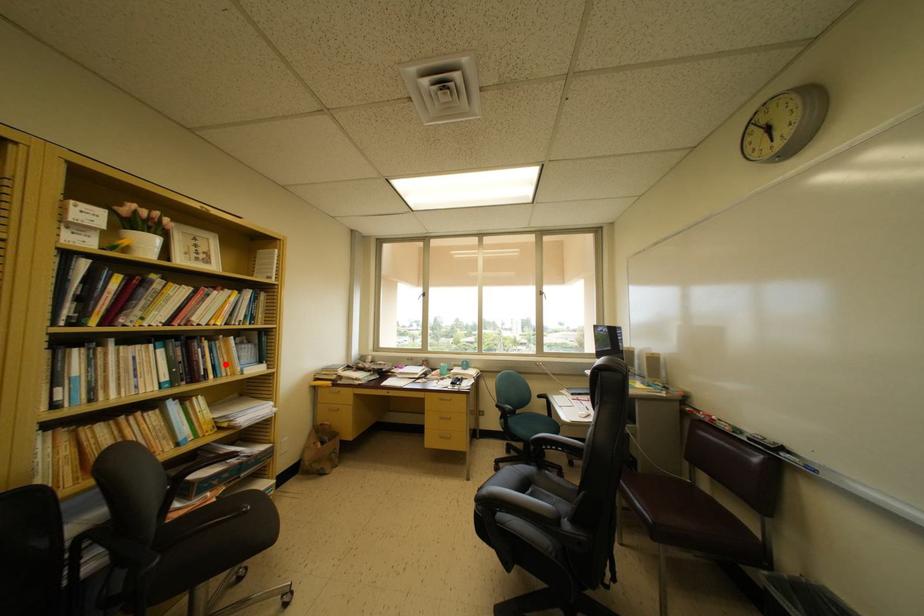
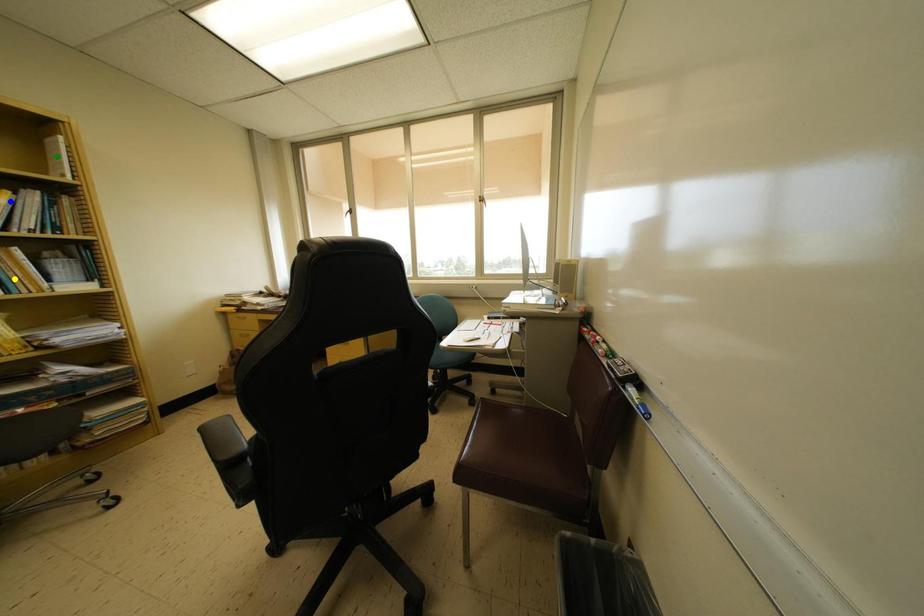
Question: I am providing you with two images of the same scene from different viewpoints. A red point is marked on the first image. You are given multiple points on the second image. Which point in image 2 represents the same 3d spot as the red point in image 1?

Choices:
 (A) yellow point
 (B) green point
 (C) blue point

Answer: (A)